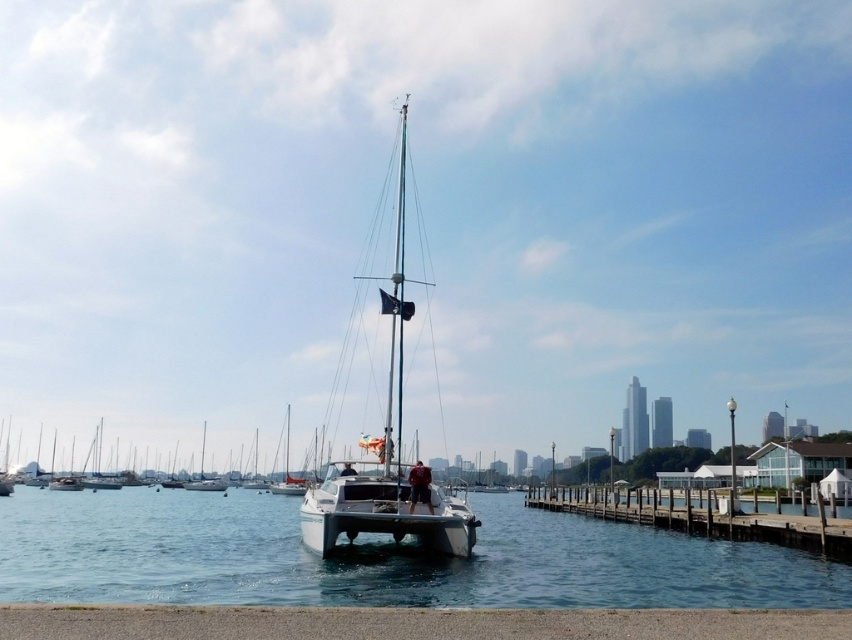
Question: Estimate the real-world distances between objects in this image. Which object is closer to the white glossy sailboat at center?

Choices:
 (A) clear blue water at center
 (B) wooden at right

Answer: (A)

Question: Is clear blue water at center below wooden at right?

Choices:
 (A) yes
 (B) no

Answer: (A)

Question: Is clear blue water at center thinner than white glossy sailboat at center?

Choices:
 (A) yes
 (B) no

Answer: (B)

Question: Observing the image, what is the correct spatial positioning of clear blue water at center in reference to white glossy sailboat at center?

Choices:
 (A) right
 (B) left

Answer: (B)

Question: Which point is farther from the camera taking this photo?

Choices:
 (A) (746, 516)
 (B) (323, 513)

Answer: (A)

Question: Among these objects, which one is nearest to the camera?

Choices:
 (A) white glossy sailboat at center
 (B) clear blue water at center

Answer: (B)